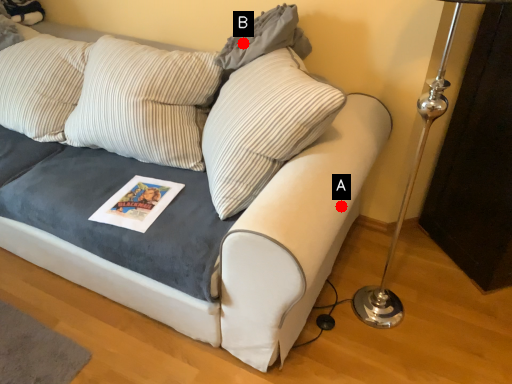
Question: Two points are circled on the image, labeled by A and B beside each circle. Which point is further to the camera?

Choices:
 (A) A is further
 (B) B is further

Answer: (B)